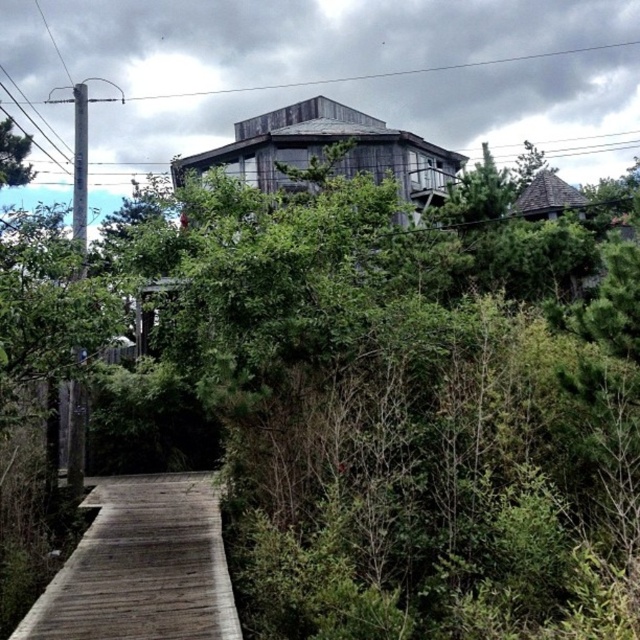
Between wooden hut at center and brown shingled hut at upper right, which one appears on the right side from the viewer's perspective?

brown shingled hut at upper right is more to the right.

Does wooden hut at center lie in front of brown shingled hut at upper right?

Yes, wooden hut at center is in front of brown shingled hut at upper right.

Find the location of a particular element. wooden hut at center is located at coordinates (x=323, y=148).

The width and height of the screenshot is (640, 640). What are the coordinates of `wooden hut at center` in the screenshot? It's located at (323, 148).

Does wooden planks at lower left appear under brown shingled hut at upper right?

Yes.

Is wooden planks at lower left closer to camera compared to brown shingled hut at upper right?

Yes.

Locate an element on the screen. wooden planks at lower left is located at coordinates (141, 566).

Locate an element on the screen. wooden planks at lower left is located at coordinates (141, 566).

Is wooden planks at lower left behind wooden hut at center?

No, it is in front of wooden hut at center.

Who is lower down, wooden planks at lower left or wooden hut at center?

wooden planks at lower left is lower down.

Who is more forward, (x=180, y=563) or (x=234, y=147)?

Point (x=180, y=563) is in front.

Where is `wooden planks at lower left`? Image resolution: width=640 pixels, height=640 pixels. wooden planks at lower left is located at coordinates (141, 566).